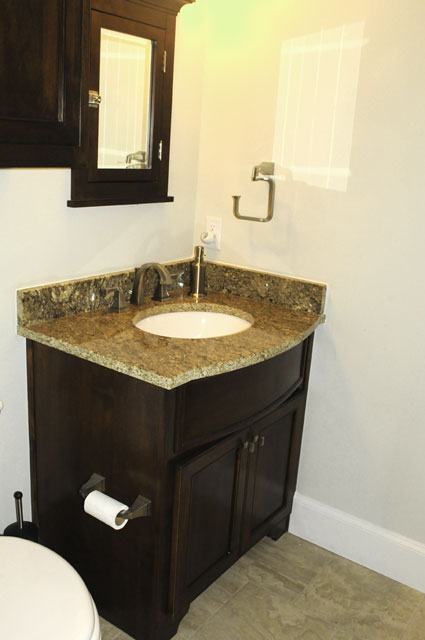
You are a GUI agent. You are given a task and a screenshot of the screen. Output one action in this format:
    pyautogui.click(x=<x>, y=<y>)
    Task: Click on the toilet brush
    The height and width of the screenshot is (640, 425).
    Given the screenshot: What is the action you would take?
    pyautogui.click(x=23, y=523)